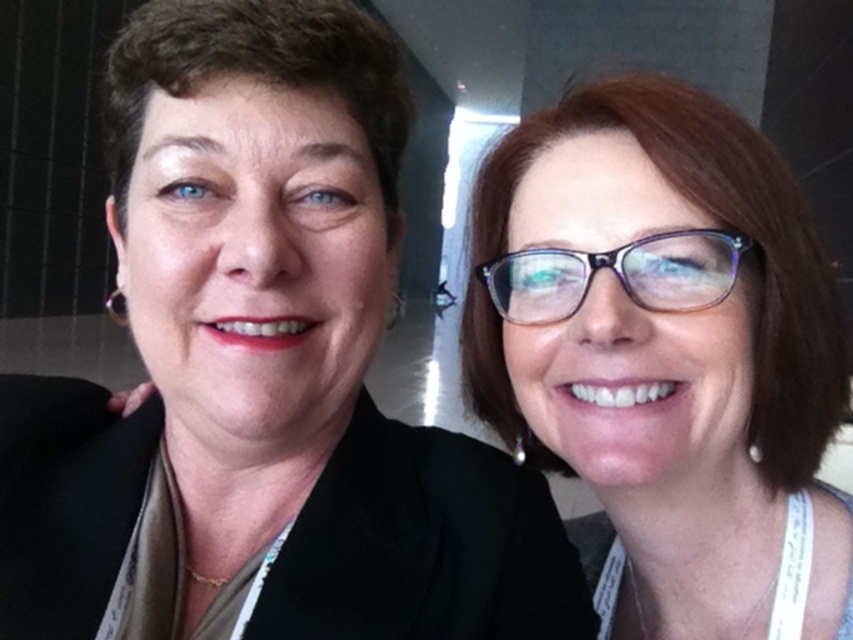
Question: Does matte black glasses at upper right appear on the right side of transparent purple glasses at right?

Choices:
 (A) no
 (B) yes

Answer: (B)

Question: Among these objects, which one is nearest to the camera?

Choices:
 (A) matte black jacket at left
 (B) matte black glasses at upper right
 (C) transparent purple glasses at right

Answer: (A)

Question: Does matte black jacket at left appear on the left side of matte black glasses at upper right?

Choices:
 (A) no
 (B) yes

Answer: (B)

Question: Which object is farther from the camera taking this photo?

Choices:
 (A) matte black jacket at left
 (B) matte black glasses at upper right

Answer: (B)

Question: From the image, what is the correct spatial relationship of matte black jacket at left in relation to transparent purple glasses at right?

Choices:
 (A) below
 (B) above

Answer: (A)

Question: Which of the following is the closest to the observer?

Choices:
 (A) matte black glasses at upper right
 (B) transparent purple glasses at right
 (C) matte black jacket at left

Answer: (C)